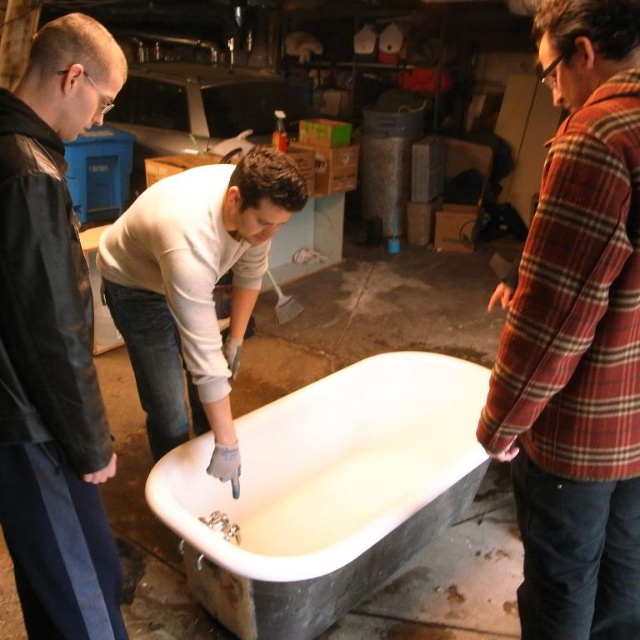
You are designing a layout for a small bathroom and need to choose between the white glossy bathtub at center and the white matte bathtub at center. Given that the bathroom has limited space, which one would you recommend based on their sizes?

The white glossy bathtub at center has a larger width than the white matte bathtub at center, so if space is a concern, the white matte bathtub at center would be more suitable due to its smaller size.

You are standing in the workshop and need to hand a tool to both the person in the red plaid shirt at right and the person in the black leather jacket at left. Which person should you approach first if you want to reach the one closer to you?

The red plaid shirt at right is located above black leather jacket at left, so the person in the black leather jacket at left is closer to you. You should approach the person in the black leather jacket at left first.